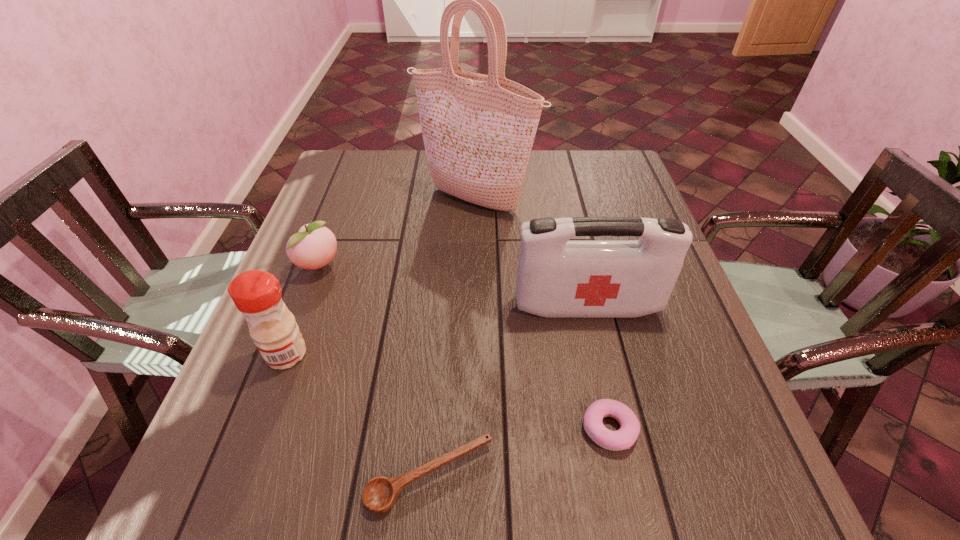
Find the location of a particular element. The height and width of the screenshot is (540, 960). blank space at the near edge is located at coordinates (378, 472).

The image size is (960, 540). In order to click on vacant space at the left edge of the desktop in this screenshot , I will do click(340, 223).

This screenshot has width=960, height=540. In order to click on free location at the right edge in this screenshot , I will do `click(671, 321)`.

Locate an element on the screen. The image size is (960, 540). empty space between the fourth tallest object and the shortest object is located at coordinates (375, 370).

Locate an element on the screen. unoccupied position between the tallest object and the wooden spoon is located at coordinates (453, 338).

Identify the location of free space between the third nearest object and the shortest object. (359, 415).

This screenshot has width=960, height=540. I want to click on vacant space that's between the shortest object and the fourth nearest object, so (509, 391).

The height and width of the screenshot is (540, 960). Find the location of `free space that is in between the wooden spoon and the pastry`. free space that is in between the wooden spoon and the pastry is located at coordinates (520, 453).

Image resolution: width=960 pixels, height=540 pixels. I want to click on blank region between the third shortest object and the fourth nearest object, so click(x=453, y=286).

Where is `empty space that is in between the pastry and the shortest object`? This screenshot has width=960, height=540. empty space that is in between the pastry and the shortest object is located at coordinates (520, 453).